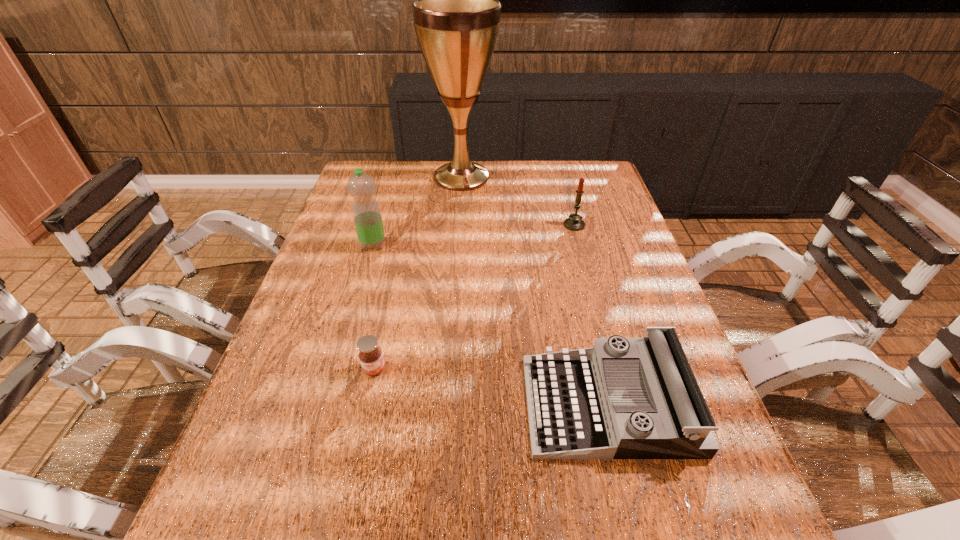
You are a GUI agent. You are given a task and a screenshot of the screen. Output one action in this format:
    pyautogui.click(x=<x>, y=<y>)
    Task: Click on the trophy cup
    This screenshot has width=960, height=540.
    Given the screenshot: What is the action you would take?
    pyautogui.click(x=456, y=15)

You are a GUI agent. You are given a task and a screenshot of the screen. Output one action in this format:
    pyautogui.click(x=<x>, y=<y>)
    Task: Click on the third object from right to left
    
    Given the screenshot: What is the action you would take?
    pyautogui.click(x=456, y=15)

Find the location of `the leftmost object`. the leftmost object is located at coordinates (367, 217).

At what (x,y) coordinates should I click in order to perform the action: click on the third farthest object. Please return your answer as a coordinate pair (x, y). Image resolution: width=960 pixels, height=540 pixels. Looking at the image, I should click on (367, 217).

What are the coordinates of `the third shortest object` in the screenshot? It's located at (574, 223).

This screenshot has width=960, height=540. Identify the location of the second farthest object. (574, 223).

Find the location of a particular element. The height and width of the screenshot is (540, 960). typewriter is located at coordinates (624, 398).

Image resolution: width=960 pixels, height=540 pixels. In order to click on the shortest object in this screenshot , I will do `click(370, 355)`.

Find the location of a particular element. The width and height of the screenshot is (960, 540). jam is located at coordinates (370, 355).

Image resolution: width=960 pixels, height=540 pixels. Identify the location of free space located on the front of the third object from left to right. (459, 221).